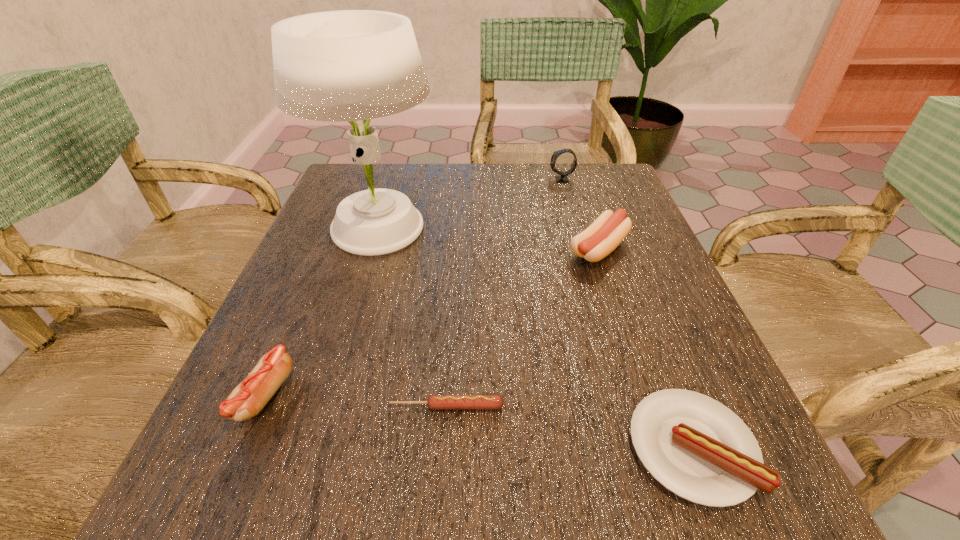
Where is `the tallest object`? The image size is (960, 540). the tallest object is located at coordinates point(348,65).

Locate an element on the screen. watch is located at coordinates (563, 176).

The width and height of the screenshot is (960, 540). Find the location of `the second tallest object`. the second tallest object is located at coordinates (563, 176).

Where is `the farthest sausage`? The height and width of the screenshot is (540, 960). the farthest sausage is located at coordinates (603, 236).

At what (x,y) coordinates should I click in order to perform the action: click on the leftmost sausage. Please return your answer as a coordinate pair (x, y). This screenshot has width=960, height=540. Looking at the image, I should click on (246, 400).

Identify the location of the third tallest sausage. (696, 447).

Find the location of a particular element. the third sausage from right to left is located at coordinates (435, 402).

Find the location of a particular element. the shortest sausage is located at coordinates (435, 402).

Locate an element on the screen. This screenshot has width=960, height=540. vacant area situated on the front-facing side of the tallest object is located at coordinates (559, 231).

What are the coordinates of `free space located on the face of the second tallest object` in the screenshot? It's located at (394, 179).